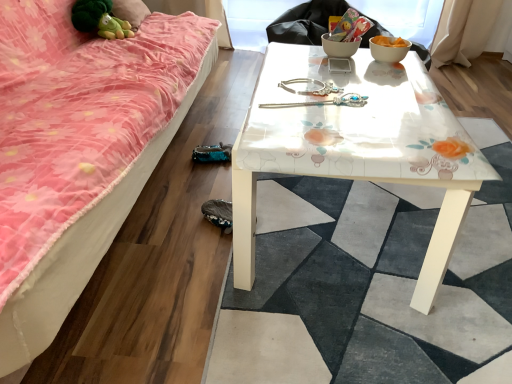
Question: Is white glossy bowl at upper right turned away from white glossy table at center?

Choices:
 (A) yes
 (B) no

Answer: (B)

Question: Does white glossy bowl at upper right come in front of white glossy table at center?

Choices:
 (A) yes
 (B) no

Answer: (B)

Question: Does white glossy bowl at upper right lie behind white glossy table at center?

Choices:
 (A) no
 (B) yes

Answer: (B)

Question: Is white glossy bowl at upper right smaller than white glossy table at center?

Choices:
 (A) no
 (B) yes

Answer: (B)

Question: From a real-world perspective, does white glossy bowl at upper right stand above white glossy table at center?

Choices:
 (A) no
 (B) yes

Answer: (B)

Question: Is point (245, 289) positioned closer to the camera than point (49, 258)?

Choices:
 (A) farther
 (B) closer

Answer: (A)

Question: Visually, is white glossy table at center positioned to the left or to the right of pink fabric studio couch at lower left?

Choices:
 (A) left
 (B) right

Answer: (B)

Question: From a real-world perspective, is white glossy table at center positioned above or below pink fabric studio couch at lower left?

Choices:
 (A) above
 (B) below

Answer: (B)

Question: Relative to pink fabric studio couch at lower left, is white glossy table at center in front or behind?

Choices:
 (A) front
 (B) behind

Answer: (B)

Question: In terms of height, does silver metallic hairpin at center look taller or shorter compared to green plush toy at upper left?

Choices:
 (A) short
 (B) tall

Answer: (A)

Question: In the image, is silver metallic hairpin at center on the left side or the right side of green plush toy at upper left?

Choices:
 (A) left
 (B) right

Answer: (B)

Question: Would you say silver metallic hairpin at center is inside or outside green plush toy at upper left?

Choices:
 (A) inside
 (B) outside

Answer: (B)

Question: Considering their positions, is silver metallic hairpin at center located in front of or behind green plush toy at upper left?

Choices:
 (A) behind
 (B) front

Answer: (B)

Question: From a real-world perspective, is silver metallic hairpin at center above or below white glossy table at center?

Choices:
 (A) above
 (B) below

Answer: (A)

Question: Considering the positions of silver metallic hairpin at center and white glossy table at center in the image, is silver metallic hairpin at center bigger or smaller than white glossy table at center?

Choices:
 (A) small
 (B) big

Answer: (A)